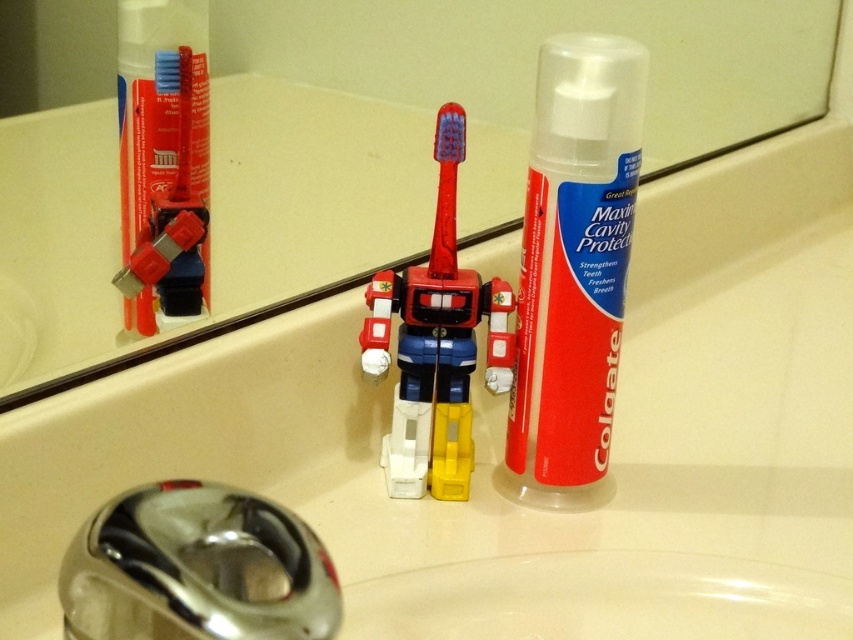
Is chrome metallic faucet at lower left shorter than red plastic toothbrush at center?

Indeed, chrome metallic faucet at lower left has a lesser height compared to red plastic toothbrush at center.

I want to click on chrome metallic faucet at lower left, so click(196, 568).

Describe the element at coordinates (196, 568) in the screenshot. I see `chrome metallic faucet at lower left` at that location.

What do you see at coordinates (196, 568) in the screenshot? I see `chrome metallic faucet at lower left` at bounding box center [196, 568].

Identify the location of chrome metallic faucet at lower left. The width and height of the screenshot is (853, 640). click(x=196, y=568).

Can you confirm if red matte toothpaste at center is wider than chrome metallic faucet at lower left?

No.

Does red matte toothpaste at center appear under chrome metallic faucet at lower left?

No, red matte toothpaste at center is not below chrome metallic faucet at lower left.

This screenshot has width=853, height=640. What do you see at coordinates (573, 269) in the screenshot? I see `red matte toothpaste at center` at bounding box center [573, 269].

Where is `red matte toothpaste at center`? This screenshot has height=640, width=853. red matte toothpaste at center is located at coordinates (573, 269).